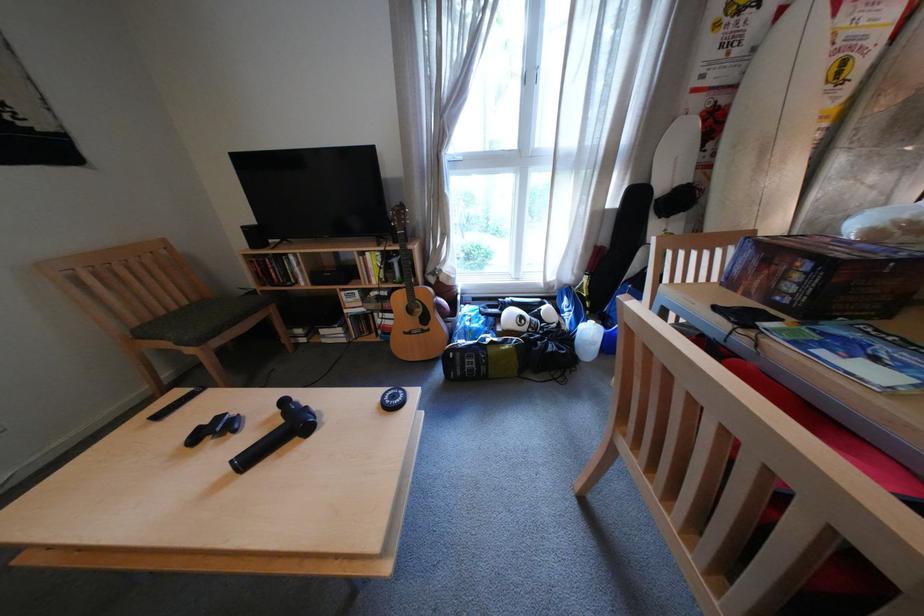
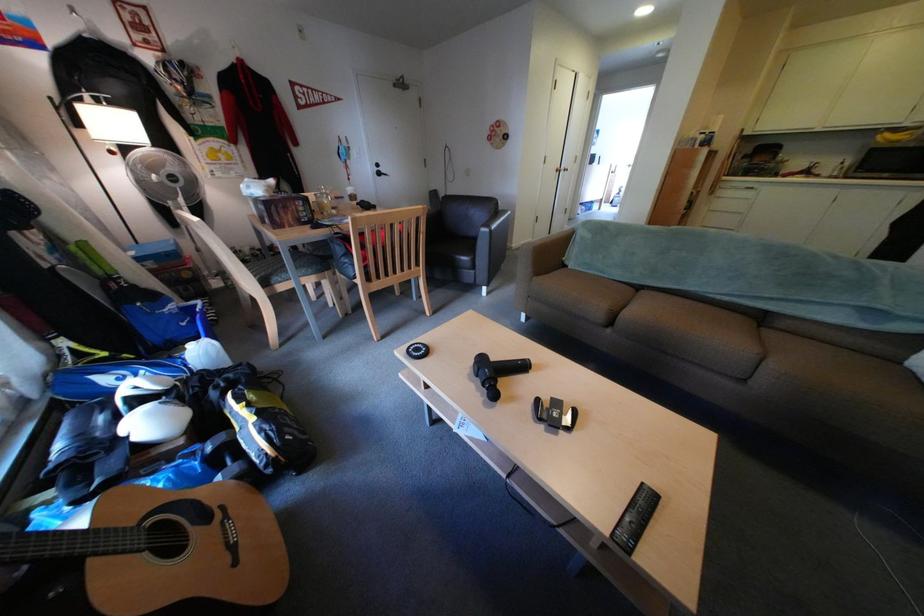
Where in the second image is the point corresponding to pixel 604 323 from the first image?

(204, 347)